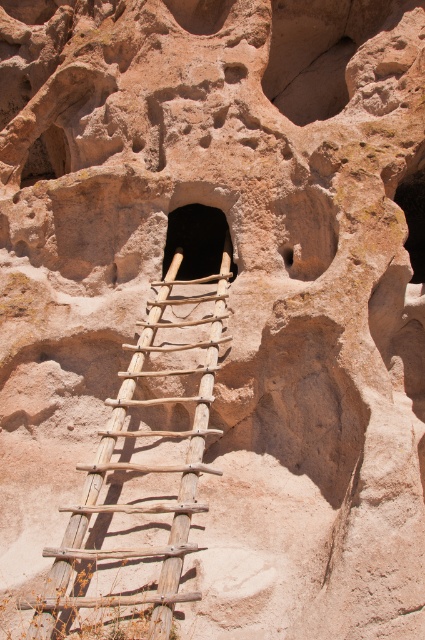
Based on the photo, you are an archaeologist preparing to explore the ancient rock structures. You have a 70 feet long rope. You need to decide whether to use it to reach either the smooth sandstone hole at center or the smooth rock cave at upper left. Based on their distance apart, can you determine which one is closer to you?

The smooth sandstone hole at center and smooth rock cave at upper left are 69.07 feet apart. Since the rope is 70 feet long, both are within reach. However, the question is about which is closer to you. The description only states their distance from each other, not from the observer. Without knowing your position relative to both, we can only confirm the distance between them, not which is nearer to you.